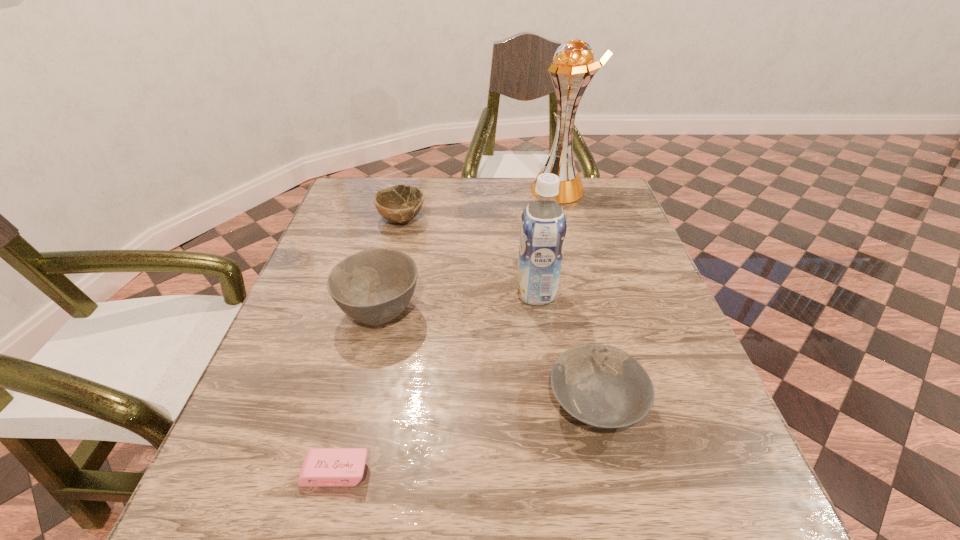
Image resolution: width=960 pixels, height=540 pixels. In order to click on trophy located at the far edge in this screenshot , I will do `click(573, 68)`.

In order to click on bowl positioned at the far edge in this screenshot , I will do `click(400, 203)`.

Where is `object present at the near edge`? object present at the near edge is located at coordinates (323, 467).

Identify the location of eraser located in the left edge section of the desktop. (323, 467).

Image resolution: width=960 pixels, height=540 pixels. Find the location of `trophy that is at the right edge`. trophy that is at the right edge is located at coordinates pos(573,68).

Where is `bowl that is at the right edge`? The height and width of the screenshot is (540, 960). bowl that is at the right edge is located at coordinates (602, 386).

Where is `object that is positioned at the far left corner`? object that is positioned at the far left corner is located at coordinates (400, 203).

Locate an element on the screen. object at the near left corner is located at coordinates (323, 467).

The width and height of the screenshot is (960, 540). I want to click on object that is at the far right corner, so click(x=573, y=68).

At what (x,y) coordinates should I click in order to perform the action: click on blank space at the far edge. Please return your answer as a coordinate pair (x, y). The height and width of the screenshot is (540, 960). Looking at the image, I should click on (493, 219).